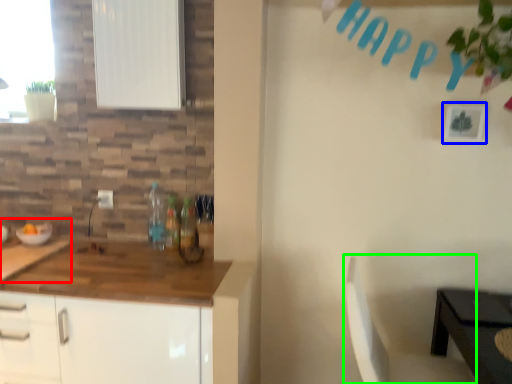
Question: Which object is positioned farthest from sink (highlighted by a red box)? Select from picture frame (highlighted by a blue box) and chair (highlighted by a green box).

Choices:
 (A) picture frame
 (B) chair

Answer: (A)